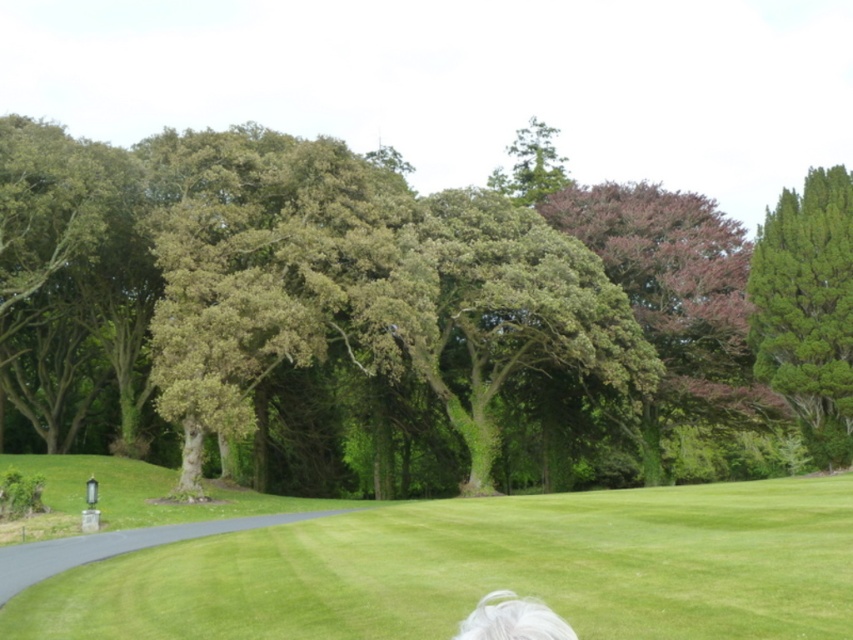
Question: Which of the following is the closest to the observer?

Choices:
 (A) (55, 540)
 (B) (791, 202)
 (C) (323, 189)

Answer: (A)

Question: In this image, where is green grass at center located relative to green coniferous tree at right?

Choices:
 (A) below
 (B) above

Answer: (A)

Question: In this image, where is green leafy tree at center located relative to gray asphalt path at lower left?

Choices:
 (A) below
 (B) above

Answer: (B)

Question: Which object is closer to the camera taking this photo?

Choices:
 (A) green coniferous tree at right
 (B) gray asphalt path at lower left

Answer: (B)

Question: Which point is closer to the camera?

Choices:
 (A) gray asphalt path at lower left
 (B) green grass at center
 (C) green leafy tree at center
 (D) green coniferous tree at right

Answer: (B)

Question: In this image, where is green grass at center located relative to green coniferous tree at right?

Choices:
 (A) left
 (B) right

Answer: (A)